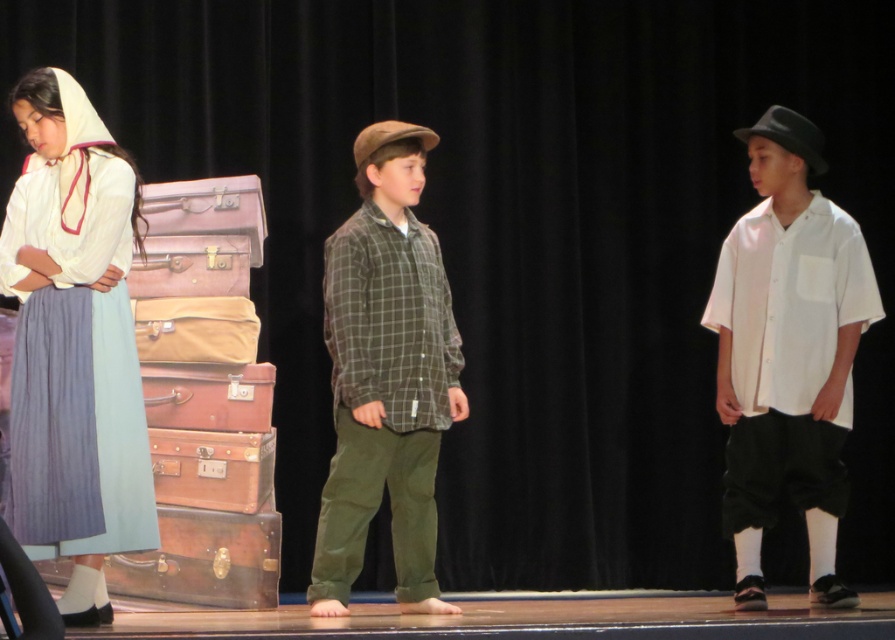
You are directing a school play and need to position two lights for the stage. The first light must be placed at point A, which is at coordinates point(774, 230), and the second light at point(427, 500). Based on the stage setup, which light will be closer to the audience?

Point(774, 230) is behind point(427, 500), so the light at point(427, 500) will be closer to the audience.